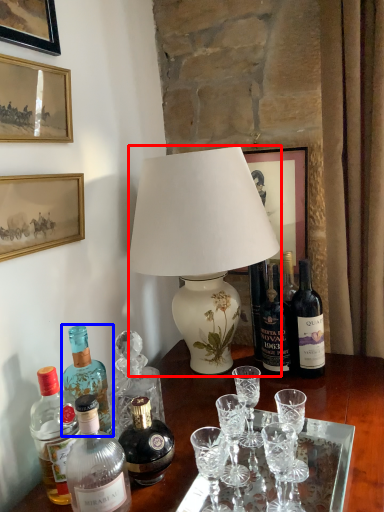
Question: Which object appears closest to the camera in this image, lamp (highlighted by a red box) or bottle (highlighted by a blue box)?

Choices:
 (A) lamp
 (B) bottle

Answer: (B)